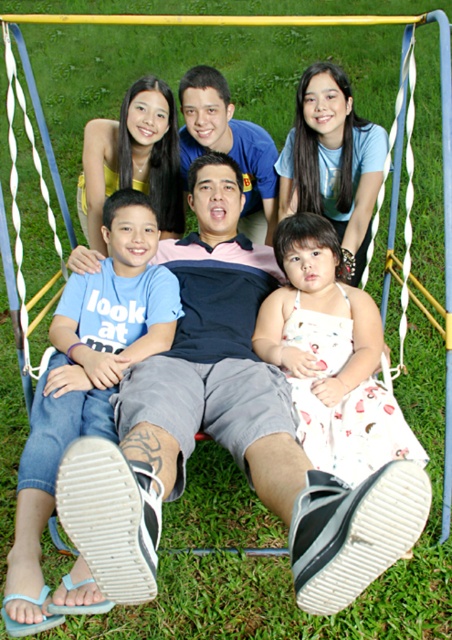
Can you confirm if blue cotton shirt at lower left is wider than white floral dress at center?

No, blue cotton shirt at lower left is not wider than white floral dress at center.

Between blue cotton shirt at lower left and white floral dress at center, which one has less height?

Standing shorter between the two is white floral dress at center.

Between point (149, 259) and point (335, 410), which one is positioned behind?

The point (149, 259) is behind.

This screenshot has height=640, width=452. Find the location of `blue cotton shirt at lower left`. blue cotton shirt at lower left is located at coordinates (86, 380).